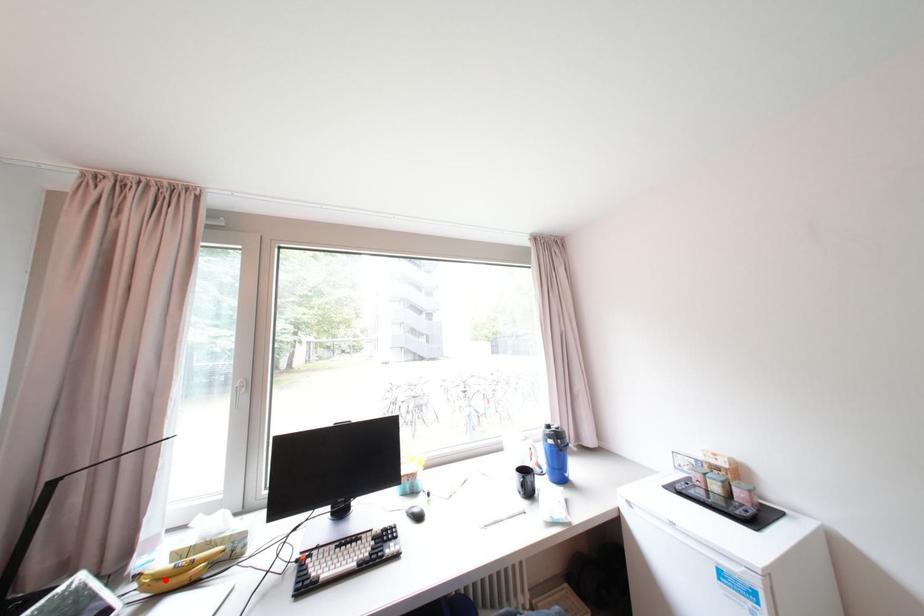
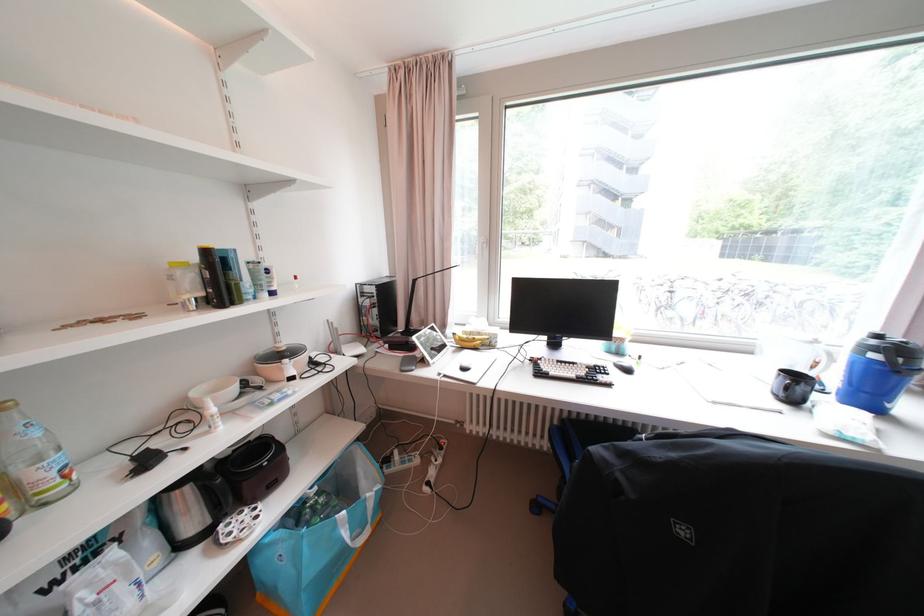
Question: I am providing you with two images of the same scene from different viewpoints. A red point is marked on the first image. Can you still see the location of the red point in image 2?

Choices:
 (A) Yes
 (B) No

Answer: (A)